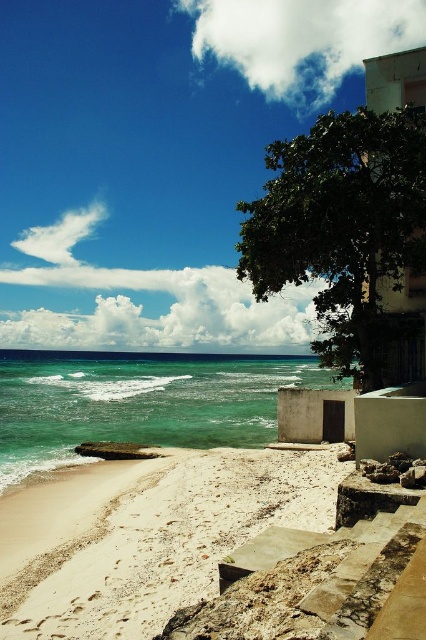
You are standing on the beach and want to walk from the green leafy tree at upper right to the clear turquoise water at center. Which direction should you head?

You should head to the left because the green leafy tree at upper right is to the right of the clear turquoise water at center, so moving left will take you towards the water.

Looking at this image, you are planning to build a small sandcastle on the white sandy beach at lower left. Considering the space available, do you think there is enough room to construct it without being too close to the clear turquoise water at center?

The white sandy beach at lower left has a width less than the clear turquoise water at center, so there might not be enough space to build a sandcastle far from the water. You may need to place it closer to avoid the water.